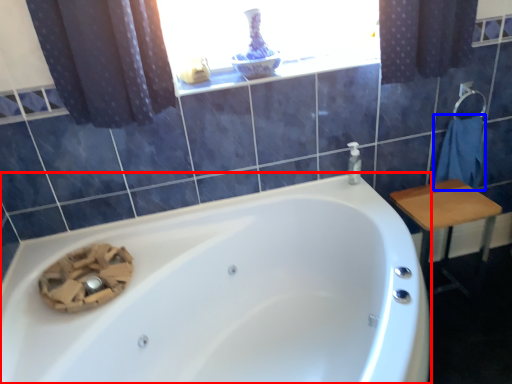
Question: Which object appears closest to the camera in this image, bathtub (highlighted by a red box) or bath towel (highlighted by a blue box)?

Choices:
 (A) bathtub
 (B) bath towel

Answer: (A)